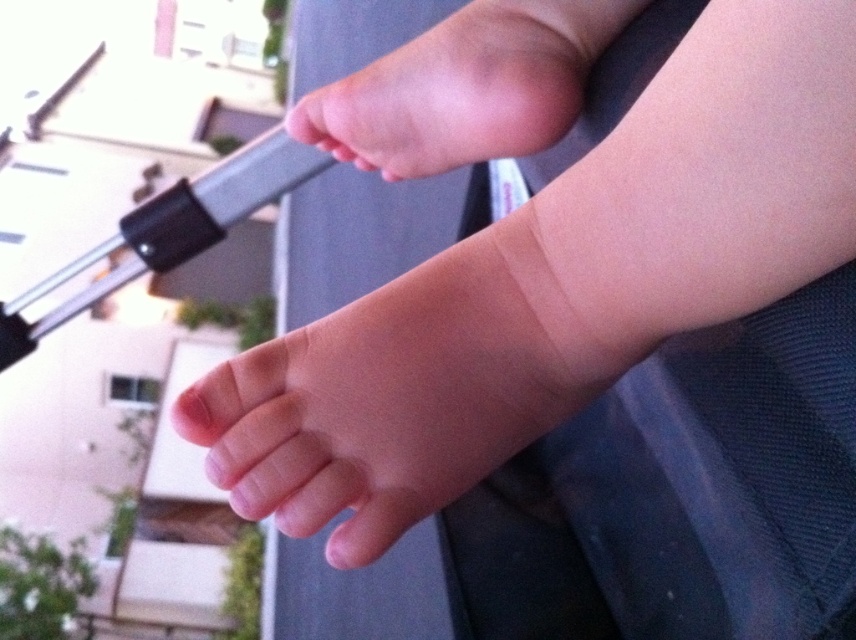
You are a pediatrician examining a baby. You notice two pink smooth foot at center and pink smooth foot at upper center. Which one is larger?

The pink smooth foot at upper center is larger than the pink smooth foot at center.

You are a photographer taking a close up photo of a baby. You notice two pink smooth foot at center and pink smooth foot at upper center in the frame. Which foot is positioned lower in the image?

The pink smooth foot at center is positioned lower than the pink smooth foot at upper center.